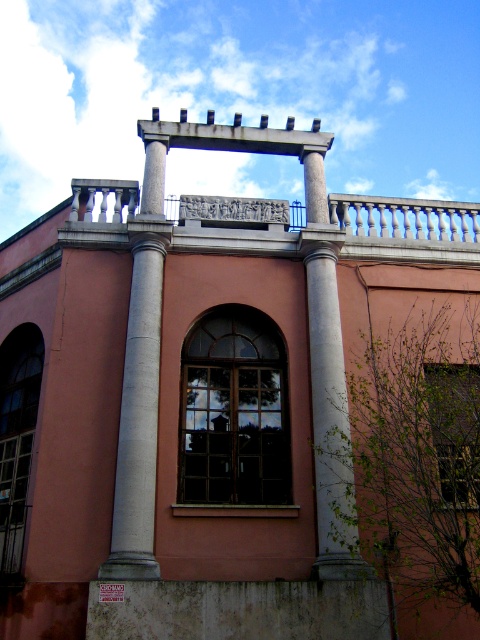
You are an architect inspecting the building facade. You notice two windows, the matte glass window at center and the clear glass window at lower left. Which one is positioned more to the east if the building faces north?

The clear glass window at lower left is positioned more to the east because it is to the left of the matte glass window at center, and since the building faces north, left would correspond to the east direction.

You are an architect reviewing the building facade. You notice the matte glass window at center and the clear glass window at lower left. Which window is positioned higher on the building?

The matte glass window at center is positioned higher on the building since it is located above the clear glass window at lower left.

Consider the image. You are an architect analyzing the building facade. You notice the gray polished stone column at left and the smooth concrete column at center. Which column is positioned further to the left side of the facade?

The gray polished stone column at left is positioned further to the left side of the facade compared to the smooth concrete column at center.